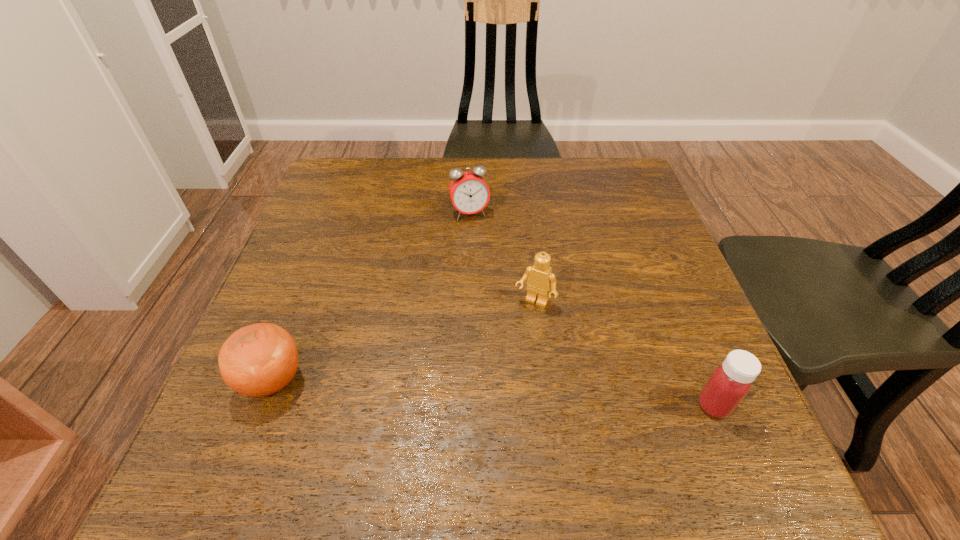
Find the location of a particular element. The image size is (960, 540). vacant spot on the desktop that is between the orange and the medicine and is positioned on the face of the Lego is located at coordinates (487, 392).

This screenshot has width=960, height=540. I want to click on free space on the desktop that is between the orange and the rightmost object and is positioned on the front-facing side of the second object from left to right, so coord(531,395).